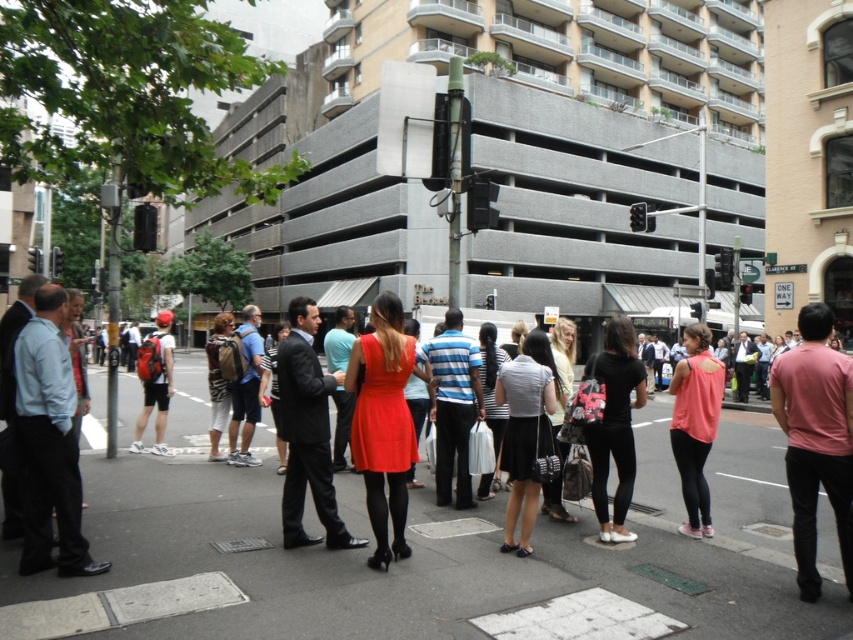
Question: Which point appears closest to the camera in this image?

Choices:
 (A) (392, 332)
 (B) (625, 467)

Answer: (A)

Question: Can you confirm if pink matte shirt at right is thinner than matte black backpack at center?

Choices:
 (A) no
 (B) yes

Answer: (B)

Question: Which point is farther from the camera taking this photo?

Choices:
 (A) (514, 435)
 (B) (328, 390)
 (C) (402, 420)
 (D) (621, 508)

Answer: (D)

Question: Is matte black backpack at center to the left of matte red backpack at center from the viewer's perspective?

Choices:
 (A) yes
 (B) no

Answer: (B)

Question: Which point is closer to the camera taking this photo?

Choices:
 (A) (302, 333)
 (B) (628, 499)
 (C) (705, 422)

Answer: (A)

Question: Is matte black dress at center below pink matte tank top at center?

Choices:
 (A) no
 (B) yes

Answer: (B)